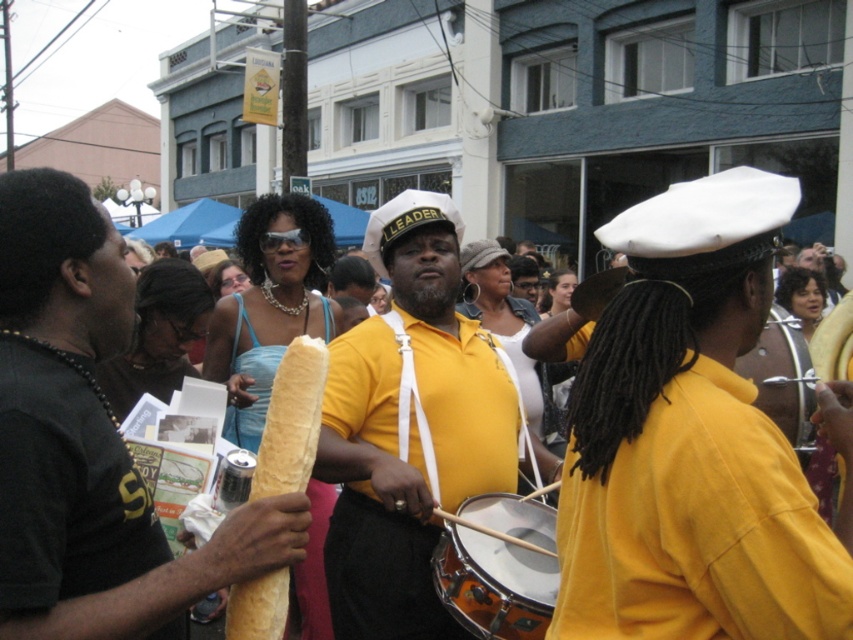
Can you confirm if yellow matte shirt at center is thinner than shiny brown drum at center?

Incorrect, yellow matte shirt at center's width is not less than shiny brown drum at center's.

Between yellow matte shirt at center and shiny brown drum at center, which one is positioned lower?

yellow matte shirt at center is lower down.

Locate an element on the screen. yellow matte shirt at center is located at coordinates (412, 428).

In order to click on yellow matte shirt at center in this screenshot , I will do `click(412, 428)`.

How far apart are yellow matte/satin shirt at center and shiny brown drum at center?

yellow matte/satin shirt at center is 3.79 feet away from shiny brown drum at center.

Who is shorter, yellow matte/satin shirt at center or shiny brown drum at center?

shiny brown drum at center is shorter.

Is point (576, 403) closer to camera compared to point (805, 362)?

Yes.

Find the location of a particular element. yellow matte/satin shirt at center is located at coordinates (689, 440).

Who is lower down, yellow matte/satin shirt at center or yellow matte shirt at center?

yellow matte shirt at center is lower down.

In the scene shown: Is yellow matte/satin shirt at center taller than yellow matte shirt at center?

No.

Locate an element on the screen. Image resolution: width=853 pixels, height=640 pixels. yellow matte/satin shirt at center is located at coordinates (689, 440).